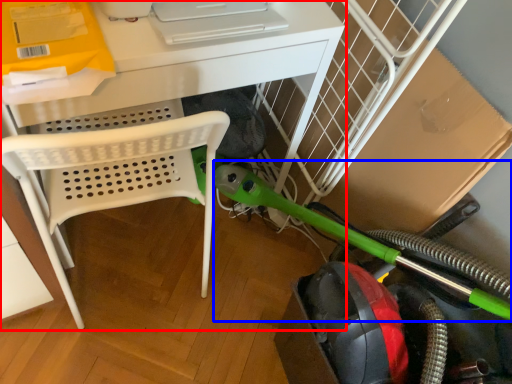
Question: Which object is closer to the camera taking this photo, desk (highlighted by a red box) or garden hose (highlighted by a blue box)?

Choices:
 (A) desk
 (B) garden hose

Answer: (B)